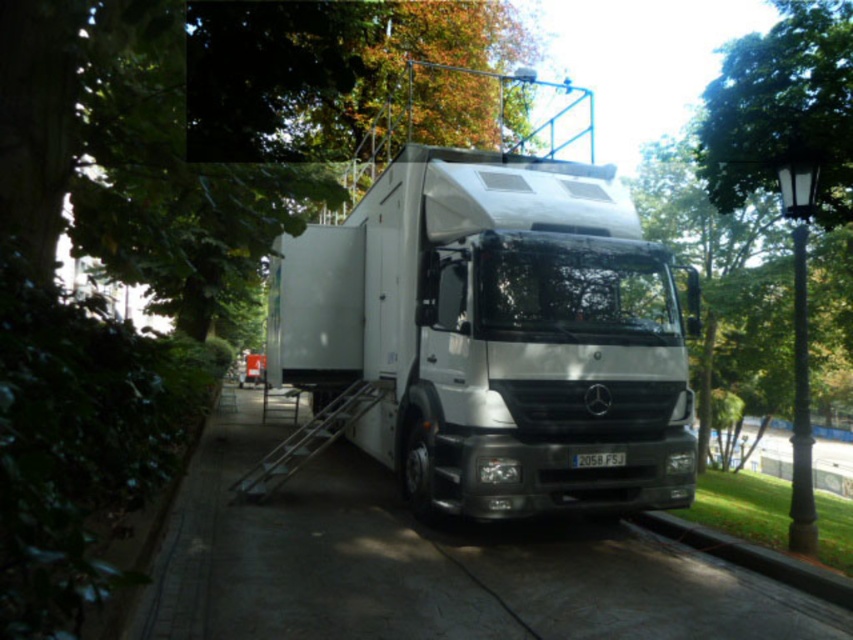
You are standing in front of the white Mercedes truck and want to determine which of the two points, point (463,492) or point (538,600), is closer to you. Based on the truck and its surroundings, which point is nearer?

Point (463,492) is closer to you because it is further to the viewer than point (538,600).

You are standing on the sidewalk and want to approach the truck. Which object is closer to you, the white metallic truck at center or the paved concrete sidewalk at center?

The paved concrete sidewalk at center is closer to you since the white metallic truck at center is further away from you than the sidewalk.

You are a delivery person trying to park your van next to the white metallic truck at center. The sidewalk is paved concrete sidewalk at center. Since the truck is narrow, will there be enough space left on the sidewalk for pedestrians to walk comfortably?

The white metallic truck at center has a lesser width compared to paved concrete sidewalk at center, so there should be enough space left on the sidewalk for pedestrians to walk comfortably.